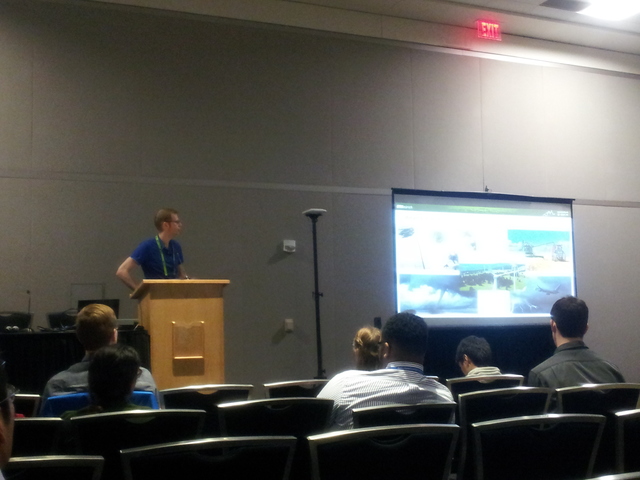
The height and width of the screenshot is (480, 640). I want to click on exit sign, so click(488, 32).